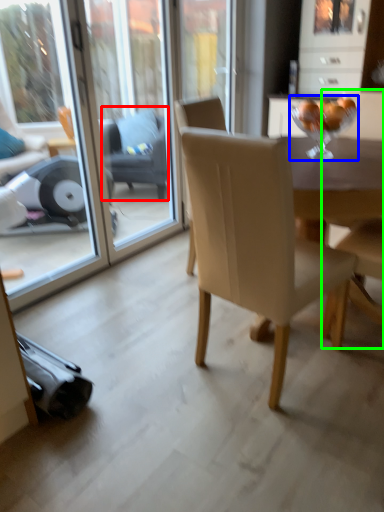
Question: Which object is positioned farthest from swivel chair (highlighted by a red box)? Select from wine glass (highlighted by a blue box) and armchair (highlighted by a green box).

Choices:
 (A) wine glass
 (B) armchair

Answer: (B)